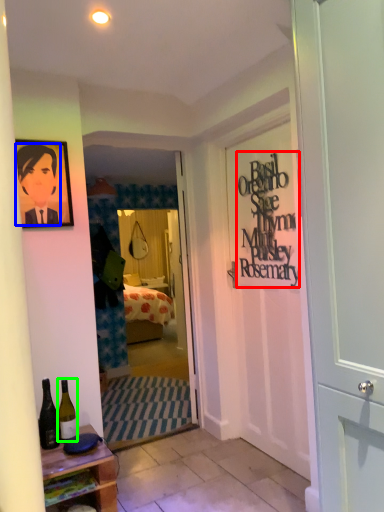
Question: Estimate the real-world distances between objects in this image. Which object is closer to writing (highlighted by a red box), person (highlighted by a blue box) or bottle (highlighted by a green box)?

Choices:
 (A) person
 (B) bottle

Answer: (A)